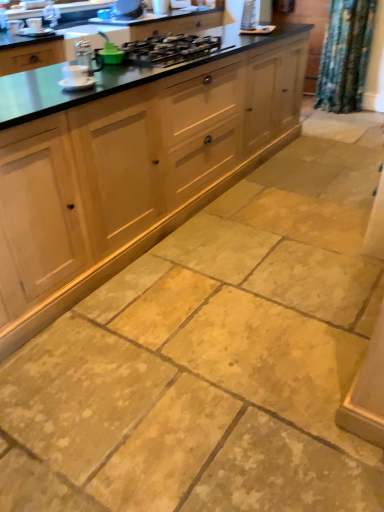
Question: Which direction should I rotate to look at green plastic brush at upper center, which is the 2th appliance in right-to-left order, — up or down?

Choices:
 (A) up
 (B) down

Answer: (A)

Question: From a real-world perspective, is white glossy mug at upper center, which appears as the first appliance when viewed from the top, over matte white cup at upper left, which is the 1th appliance in left-to-right order?

Choices:
 (A) yes
 (B) no

Answer: (A)

Question: From the image's perspective, is white glossy mug at upper center, which is the first appliance in right-to-left order, on top of matte white cup at upper left, which is the third appliance in front-to-back order?

Choices:
 (A) yes
 (B) no

Answer: (A)

Question: Is white glossy mug at upper center, which is the first appliance in right-to-left order, thinner than matte white cup at upper left, the 3th appliance in the back-to-front sequence?

Choices:
 (A) yes
 (B) no

Answer: (B)

Question: Could you tell me if white glossy mug at upper center, the 5th appliance from the left, is facing matte white cup at upper left, which is the 1th appliance in left-to-right order?

Choices:
 (A) no
 (B) yes

Answer: (A)

Question: Can you see white glossy mug at upper center, which is the fifth appliance in front-to-back order, touching matte white cup at upper left, which is the 1th appliance in left-to-right order?

Choices:
 (A) no
 (B) yes

Answer: (A)

Question: Is natural wood cabinets at center not within white glossy mug at upper center, which is the fifth appliance in front-to-back order?

Choices:
 (A) yes
 (B) no

Answer: (A)

Question: Does natural wood cabinets at center have a larger size compared to white glossy mug at upper center, the 5th appliance from the left?

Choices:
 (A) yes
 (B) no

Answer: (A)

Question: Is white glossy mug at upper center, arranged as the 1th appliance when viewed from the back, completely or partially inside natural wood cabinets at center?

Choices:
 (A) no
 (B) yes

Answer: (A)

Question: Does natural wood cabinets at center lie in front of white glossy mug at upper center, arranged as the 1th appliance when viewed from the back?

Choices:
 (A) no
 (B) yes

Answer: (B)

Question: From a real-world perspective, is natural wood cabinets at center under white glossy mug at upper center, acting as the fifth appliance starting from the bottom?

Choices:
 (A) yes
 (B) no

Answer: (A)

Question: Does natural wood cabinets at center appear on the right side of white glossy mug at upper center, which is the first appliance in right-to-left order?

Choices:
 (A) yes
 (B) no

Answer: (A)

Question: Can you confirm if white ceramic cup at upper left, arranged as the 3th appliance when viewed from the right, is thinner than metallic silver kettle at upper center, the fourth appliance in the right-to-left sequence?

Choices:
 (A) yes
 (B) no

Answer: (A)